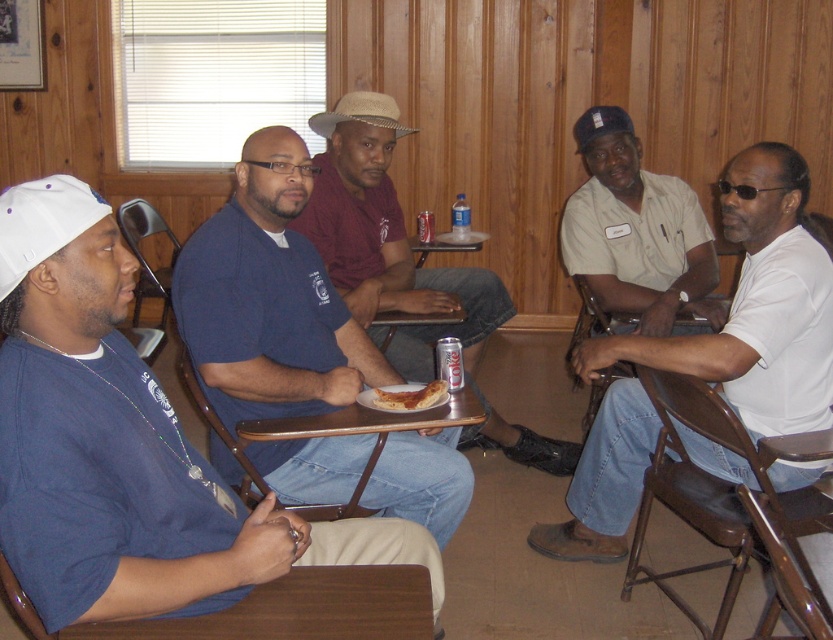
Is khaki uniform shirt at center taller than strawhat at center?

Yes, khaki uniform shirt at center is taller than strawhat at center.

Does point (601, 305) lie behind point (353, 97)?

Yes, it is.

Where is `khaki uniform shirt at center`? The image size is (833, 640). khaki uniform shirt at center is located at coordinates (636, 232).

Who is higher up, white shirt at right or brown wood table at center?

white shirt at right

Locate an element on the screen. The image size is (833, 640). white shirt at right is located at coordinates (756, 307).

Does brown wood table at center appear under strawhat at center?

Yes.

Can you confirm if brown wood table at center is taller than strawhat at center?

Correct, brown wood table at center is much taller as strawhat at center.

Who is more distant from viewer, (x=247, y=493) or (x=383, y=97)?

The point (x=383, y=97) is more distant.

At what (x,y) coordinates should I click in order to perform the action: click on brown wood table at center. Please return your answer as a coordinate pair (x, y). Looking at the image, I should click on (345, 436).